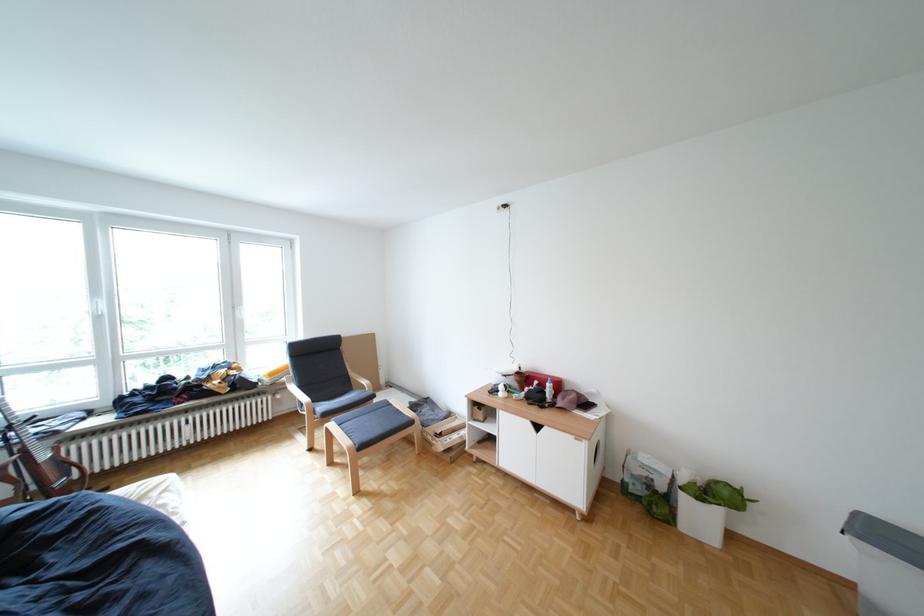
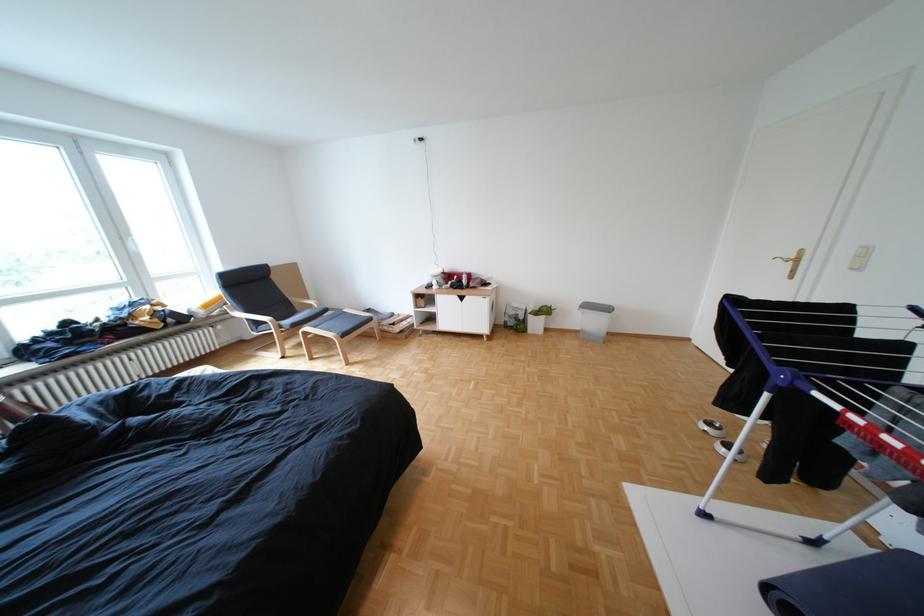
In the second image, find the point that corresponds to point 427,423 in the first image.

(386, 320)